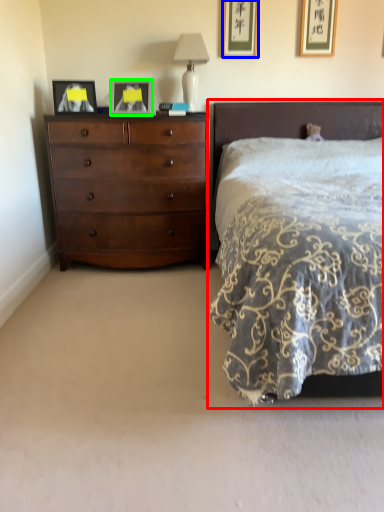
Question: Which object is positioned farthest from bed (highlighted by a red box)? Select from picture frame (highlighted by a blue box) and picture frame (highlighted by a green box).

Choices:
 (A) picture frame
 (B) picture frame

Answer: (B)